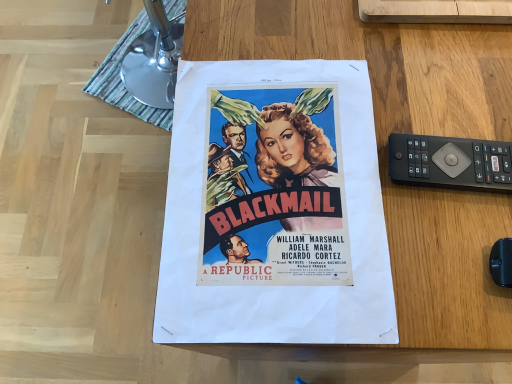
This screenshot has width=512, height=384. What are the coordinates of `blank area to the left of matte paper poster at center` in the screenshot? It's located at (78, 170).